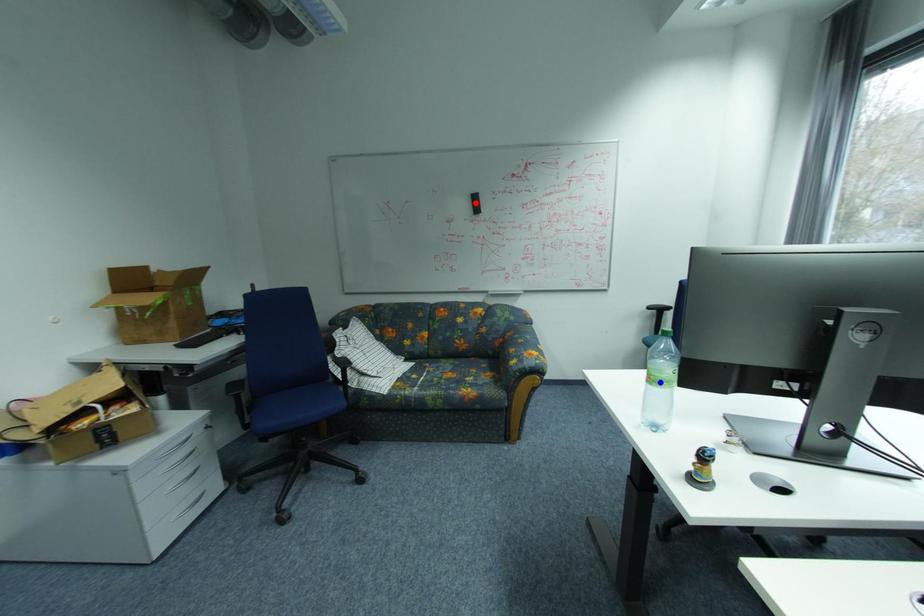
Question: Two points are marked on the image. Which point is closer to the camera?

Choices:
 (A) Blue point is closer.
 (B) Red point is closer.

Answer: (A)